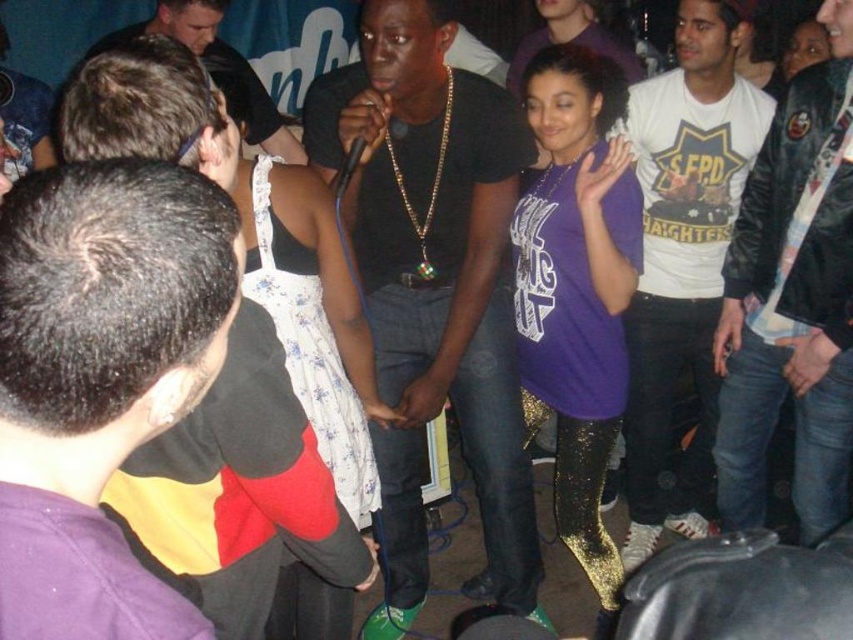
Question: Which point appears farthest from the camera in this image?

Choices:
 (A) (343, 490)
 (B) (751, 83)
 (C) (225, 0)

Answer: (C)

Question: Which of the following is the closest to the observer?

Choices:
 (A) (344, 449)
 (B) (825, 337)
 (C) (758, 88)

Answer: (A)

Question: Which object is the farthest from the matte black shirt at center?

Choices:
 (A) black matte shirt at center
 (B) white cotton t-shirt at upper right

Answer: (B)

Question: In this image, where is matte black shirt at center located relative to matte black shirt at upper left?

Choices:
 (A) left
 (B) right

Answer: (B)

Question: Can you confirm if black leather jacket at right is bigger than white cotton t-shirt at upper right?

Choices:
 (A) yes
 (B) no

Answer: (B)

Question: Is black matte shirt at center above black leather jacket at right?

Choices:
 (A) yes
 (B) no

Answer: (B)